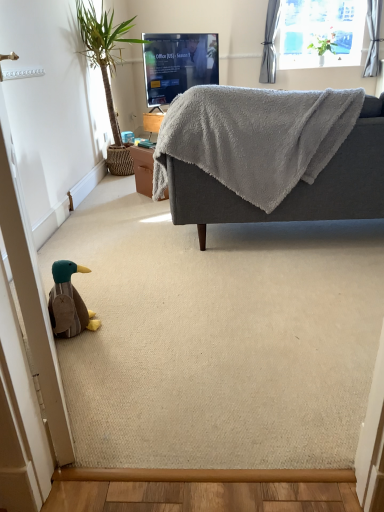
The width and height of the screenshot is (384, 512). I want to click on vacant space in between gray soft fabric couch at upper right and brown plush duck at lower left, so click(x=228, y=278).